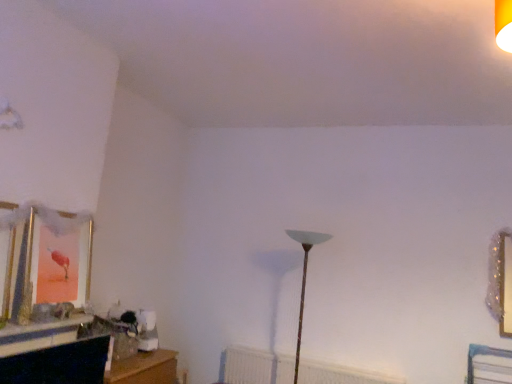
Question: Does point pos(302,294) appear closer or farther from the camera than point pos(381,382)?

Choices:
 (A) closer
 (B) farther

Answer: (A)

Question: In the image, is translucent glass lamp at center positioned in front of or behind white textured radiator at center?

Choices:
 (A) behind
 (B) front

Answer: (B)

Question: Considering the positions of translucent glass lamp at center and white textured radiator at center in the image, is translucent glass lamp at center taller or shorter than white textured radiator at center?

Choices:
 (A) tall
 (B) short

Answer: (A)

Question: Is point (228, 347) closer or farther from the camera than point (316, 233)?

Choices:
 (A) closer
 (B) farther

Answer: (B)

Question: Looking at their shapes, would you say white textured radiator at center is wider or thinner than translucent glass lamp at center?

Choices:
 (A) wide
 (B) thin

Answer: (B)

Question: Considering the relative positions of white textured radiator at center and translucent glass lamp at center in the image provided, is white textured radiator at center to the left or to the right of translucent glass lamp at center?

Choices:
 (A) left
 (B) right

Answer: (B)

Question: Is white textured radiator at center situated inside translucent glass lamp at center or outside?

Choices:
 (A) inside
 (B) outside

Answer: (B)